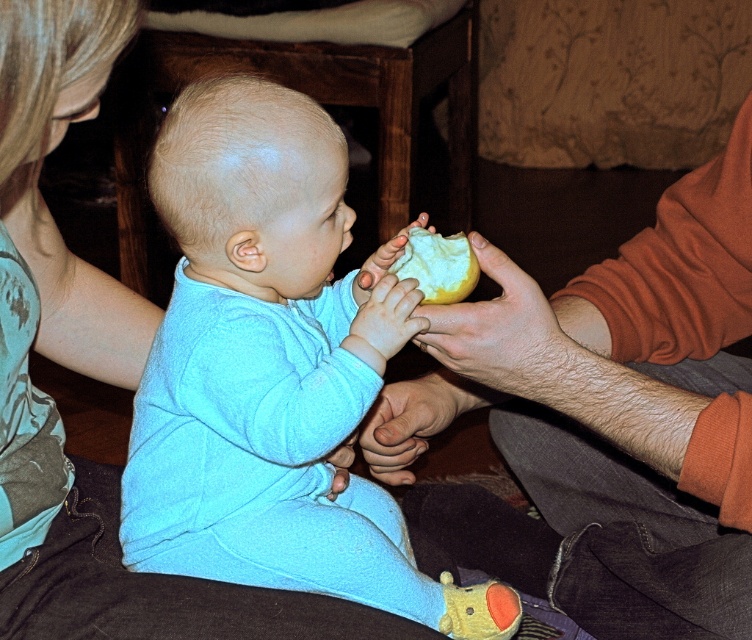
Consider the image. You are a photographer trying to capture the light blue fleece baby at center. Based on their position, which direction should you adjust your camera to ensure the baby is centered in the frame?

The light blue fleece baby at center is already positioned at the center coordinates of the image, so no adjustment is needed.

You are a parent holding a yellow matte apple at center and want to hand it to your baby. The baby is sitting on a dark surface. The matte orange sweater at right belongs to another parent. Which parent should you hand the apple to based on their position relative to the baby?

The matte orange sweater at right is below the yellow matte apple at center, so the parent wearing the matte orange sweater at right is positioned lower than the apple. You should hand the apple to the parent on the left who is at a higher position relative to the baby.

You are a parent trying to decide whether to place a small toy between the matte orange sweater at right and the yellow matte apple at center. Based on their heights, will the toy be visible from below?

The matte orange sweater at right is much taller than the yellow matte apple at center, so placing the toy between them might block visibility from below depending on the sweater height.